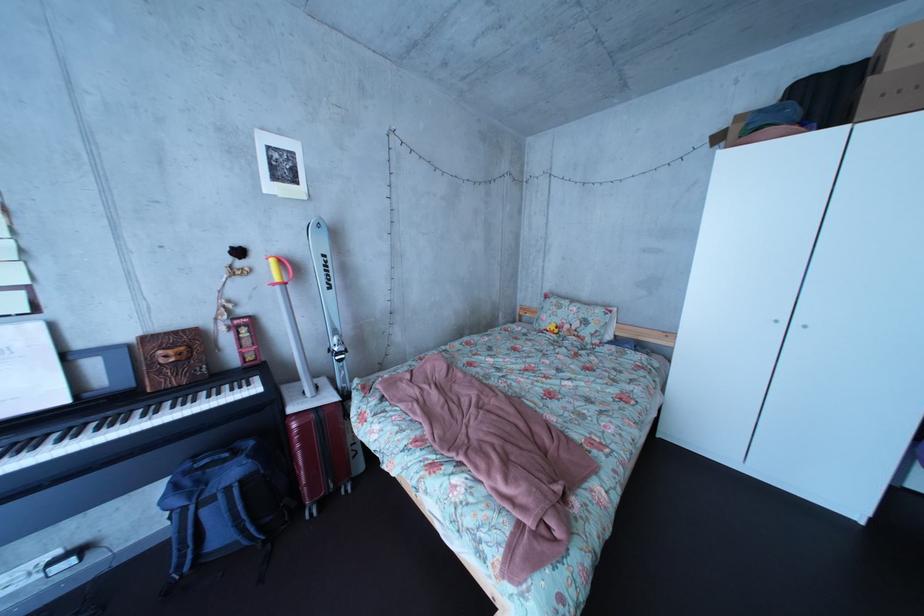
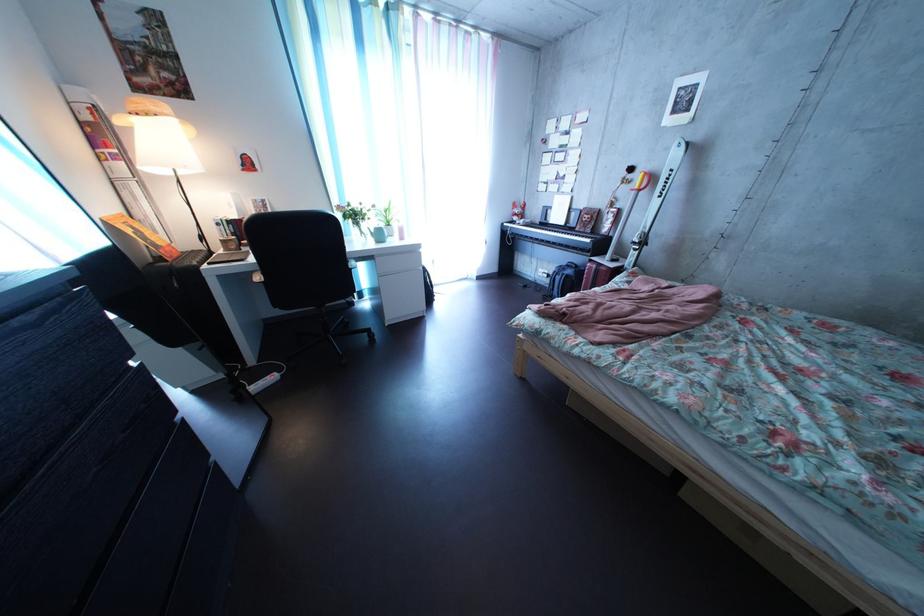
Where in the second image is the point corresponding to pixel 353 362 from the first image?

(648, 252)